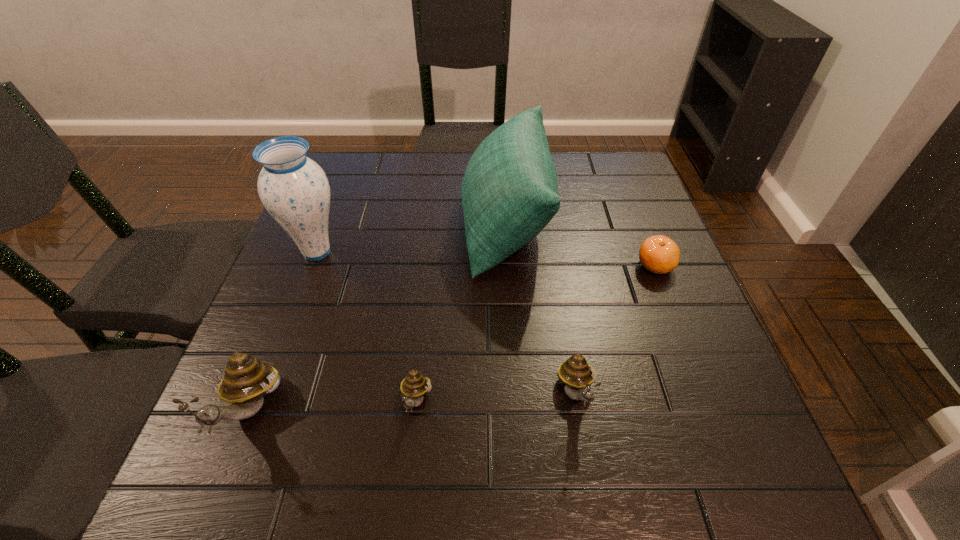
Locate an element on the screen. the third tallest object is located at coordinates (246, 381).

Locate an element on the screen. The width and height of the screenshot is (960, 540). the tallest snail is located at coordinates (246, 381).

I want to click on the third object from left to right, so click(415, 385).

The height and width of the screenshot is (540, 960). I want to click on the fifth tallest object, so (415, 385).

This screenshot has width=960, height=540. What are the coordinates of `the rightmost snail` in the screenshot? It's located at (575, 373).

Where is `the third shortest object`? The width and height of the screenshot is (960, 540). the third shortest object is located at coordinates (575, 373).

Where is `the second tallest object`? Image resolution: width=960 pixels, height=540 pixels. the second tallest object is located at coordinates (509, 193).

Where is `vase`? vase is located at coordinates click(x=294, y=189).

Find the location of `the rightmost object`. the rightmost object is located at coordinates (659, 254).

Locate an element on the screen. The width and height of the screenshot is (960, 540). the shortest object is located at coordinates (659, 254).